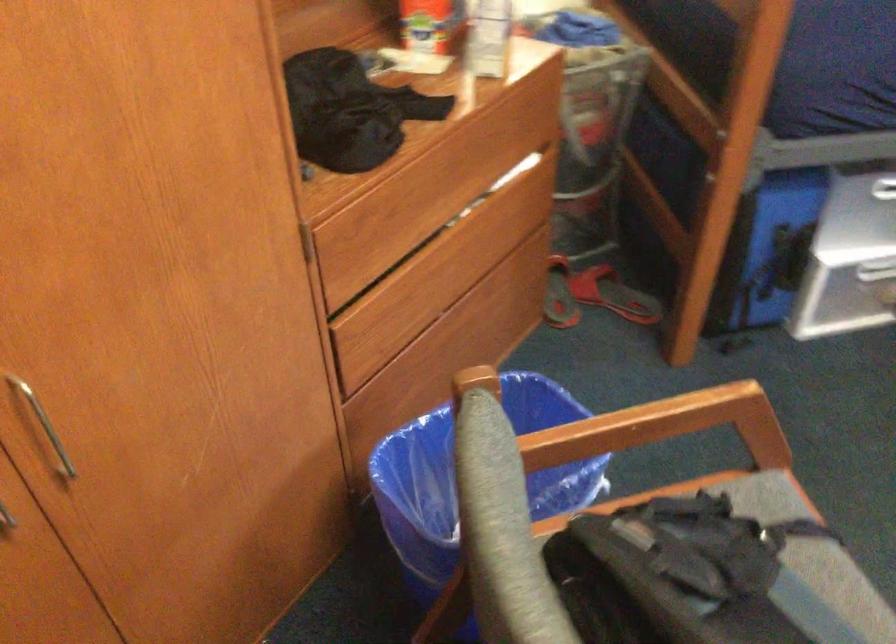
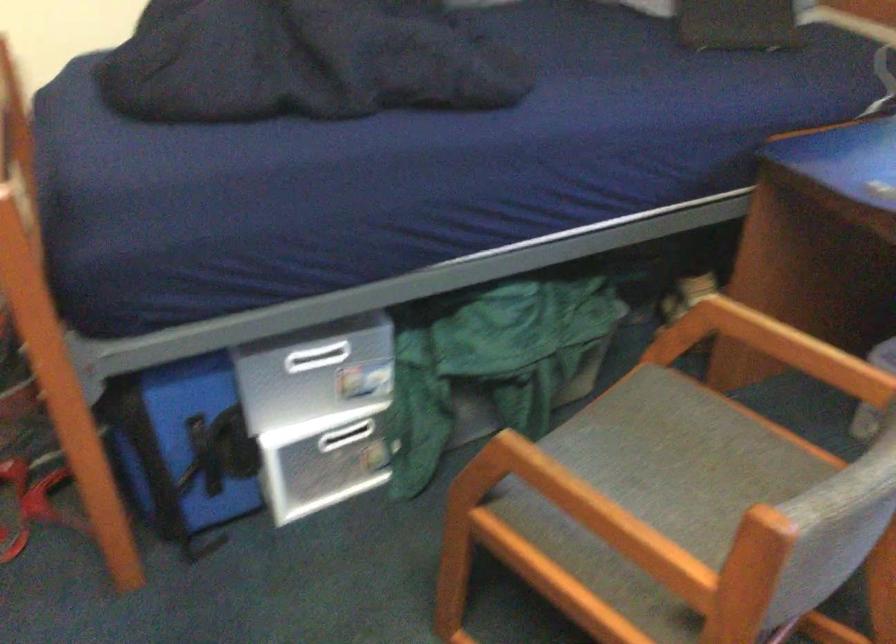
Where in the second image is the point corresponding to pixel 778 237 from the first image?

(200, 428)